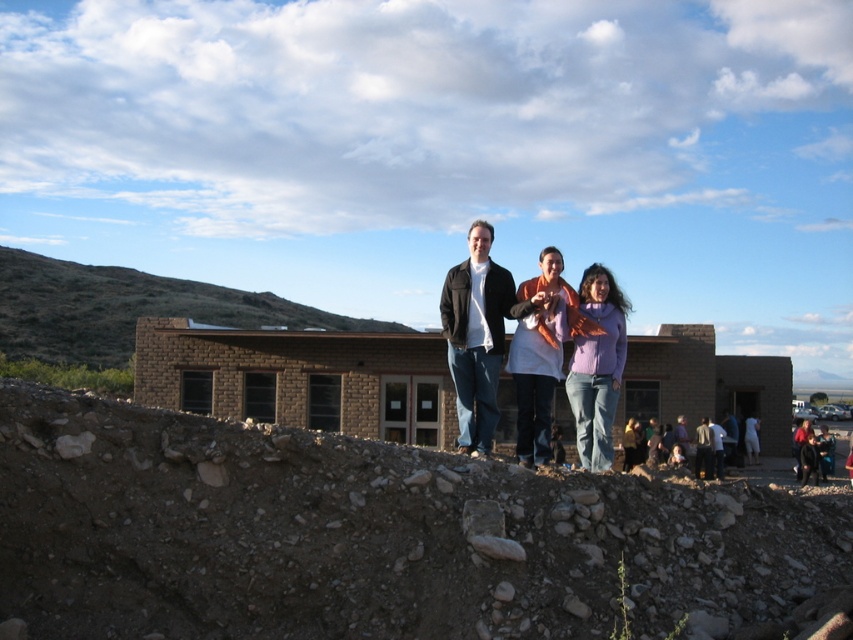
Question: Which object is positioned closest to the orange scarf at center?

Choices:
 (A) dark gray shirt at center
 (B) black leather jacket at center

Answer: (A)

Question: Is purple sweater at center to the left of multicolored fabric at center from the viewer's perspective?

Choices:
 (A) no
 (B) yes

Answer: (B)

Question: Which object is positioned closest to the rough stone hill at lower left?

Choices:
 (A) black leather jacket at center
 (B) matte black jacket at center

Answer: (B)

Question: Can you confirm if matte black jacket at center is positioned below multicolored fabric at center?

Choices:
 (A) no
 (B) yes

Answer: (A)

Question: Which point is closer to the camera?

Choices:
 (A) (447, 291)
 (B) (653, 456)

Answer: (A)

Question: Can you confirm if brown rocky hill at upper left is positioned above multicolored fabric at center?

Choices:
 (A) yes
 (B) no

Answer: (A)